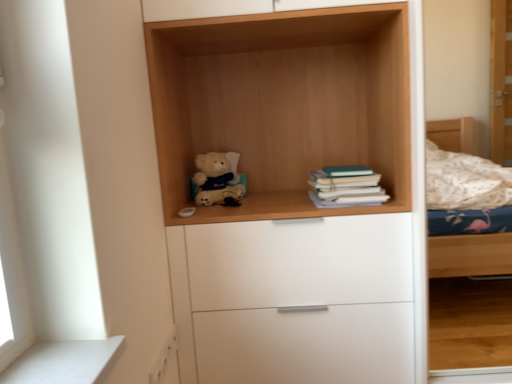
Question: Is point (225, 274) positioned closer to the camera than point (231, 170)?

Choices:
 (A) farther
 (B) closer

Answer: (B)

Question: From their relative heights in the image, would you say light wood/texture teddy bear at center is taller or shorter than soft plush teddy bear at center?

Choices:
 (A) short
 (B) tall

Answer: (B)

Question: Considering the real-world distances, which object is farthest from the white matte chest of drawers at center?

Choices:
 (A) teal matte book at center right
 (B) soft plush teddy bear at center
 (C) white matte drawer at lower left
 (D) light wood/texture teddy bear at center

Answer: (B)

Question: Which object is positioned closest to the light wood/texture teddy bear at center?

Choices:
 (A) white matte chest of drawers at center
 (B) teal matte book at center right
 (C) white matte drawer at lower left
 (D) soft plush teddy bear at center

Answer: (A)